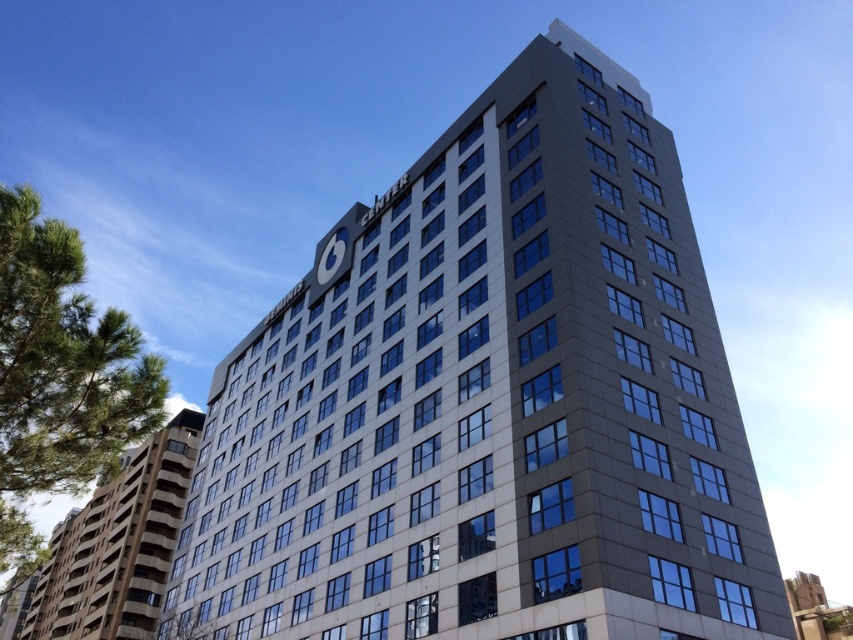
Question: Is slate gray building at center positioned behind gray concrete building at lower left?

Choices:
 (A) yes
 (B) no

Answer: (A)

Question: Which point is farther from the camera taking this photo?

Choices:
 (A) (560, 369)
 (B) (149, 499)

Answer: (B)

Question: Which point appears farthest from the camera in this image?

Choices:
 (A) (155, 584)
 (B) (424, 236)

Answer: (A)

Question: Does slate gray building at center come in front of gray concrete building at lower left?

Choices:
 (A) yes
 (B) no

Answer: (B)

Question: Can you confirm if slate gray building at center is positioned to the left of gray concrete building at lower left?

Choices:
 (A) no
 (B) yes

Answer: (A)